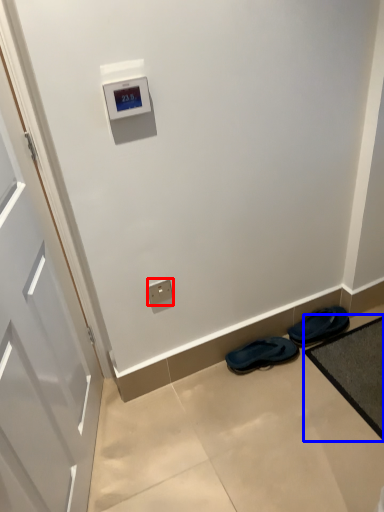
Question: Which point is further to the camera, electric outlet (highlighted by a red box) or bath mat (highlighted by a blue box)?

Choices:
 (A) electric outlet
 (B) bath mat

Answer: (A)